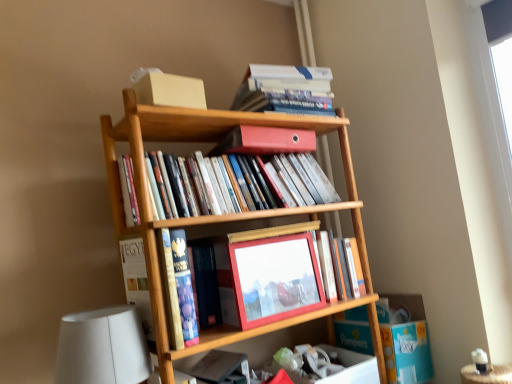
Question: Can you confirm if white matte table lamp at lower left is smaller than matte red picture frame at center?

Choices:
 (A) yes
 (B) no

Answer: (B)

Question: Is white matte table lamp at lower left located outside matte red picture frame at center?

Choices:
 (A) no
 (B) yes

Answer: (B)

Question: From a real-world perspective, is white matte table lamp at lower left on top of matte red picture frame at center?

Choices:
 (A) no
 (B) yes

Answer: (A)

Question: Does white matte table lamp at lower left have a larger size compared to matte red picture frame at center?

Choices:
 (A) yes
 (B) no

Answer: (A)

Question: Is white matte table lamp at lower left with matte red picture frame at center?

Choices:
 (A) yes
 (B) no

Answer: (B)

Question: Is white matte table lamp at lower left taller than matte red picture frame at center?

Choices:
 (A) no
 (B) yes

Answer: (B)

Question: Is matte red picture frame at center thinner than matte wooden frame at center, which appears as the fourth book when viewed from the top?

Choices:
 (A) no
 (B) yes

Answer: (B)

Question: Is matte red picture frame at center not inside matte wooden frame at center, which appears as the fourth book when viewed from the top?

Choices:
 (A) yes
 (B) no

Answer: (A)

Question: Is matte red picture frame at center wider than matte wooden frame at center, placed as the third book when sorted from bottom to top?

Choices:
 (A) no
 (B) yes

Answer: (A)

Question: Does matte red picture frame at center come in front of matte wooden frame at center, which appears as the fourth book when viewed from the top?

Choices:
 (A) yes
 (B) no

Answer: (A)

Question: Is matte red picture frame at center bigger than matte wooden frame at center, placed as the third book when sorted from bottom to top?

Choices:
 (A) yes
 (B) no

Answer: (A)

Question: Would you say matte red picture frame at center contains matte wooden frame at center, which appears as the fourth book when viewed from the top?

Choices:
 (A) yes
 (B) no

Answer: (B)

Question: Considering the relative positions of matte plastic binder at center, which appears as the fourth book when ordered from the bottom, and hardcover book at upper center, which is counted as the 6th book, starting from the bottom, in the image provided, is matte plastic binder at center, which appears as the fourth book when ordered from the bottom, to the right of hardcover book at upper center, which is counted as the 6th book, starting from the bottom, from the viewer's perspective?

Choices:
 (A) no
 (B) yes

Answer: (A)